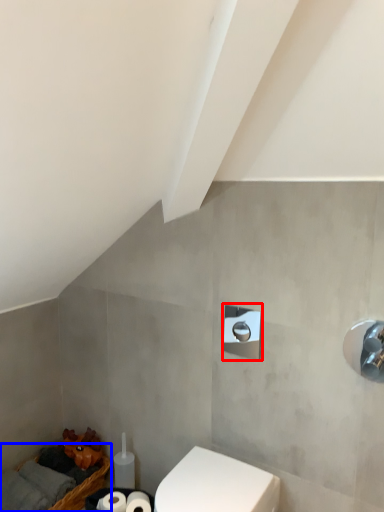
Question: Among these objects, which one is nearest to the camera, shower (highlighted by a red box) or basket (highlighted by a blue box)?

Choices:
 (A) shower
 (B) basket

Answer: (A)